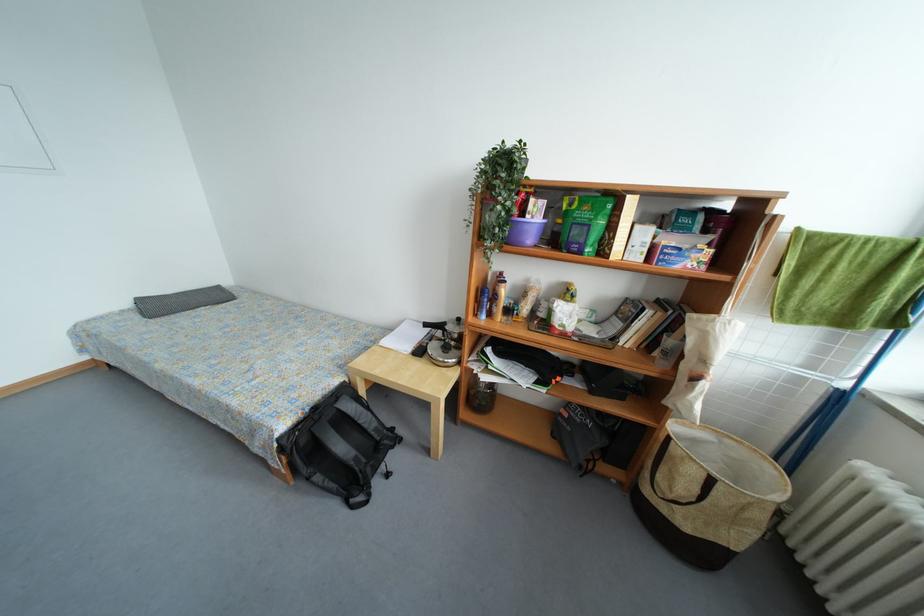
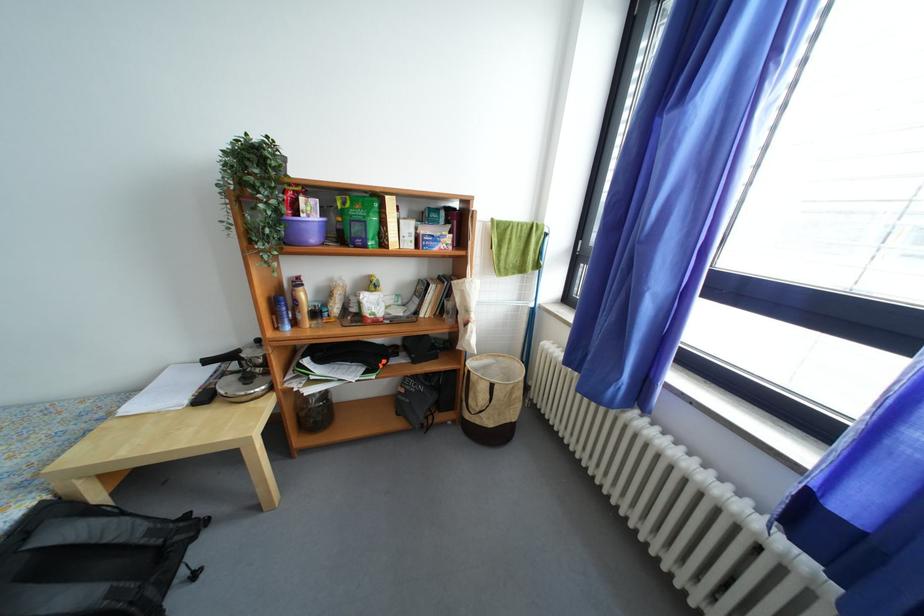
Find the pixel in the second image that matches point 488,317 in the first image.

(289, 329)